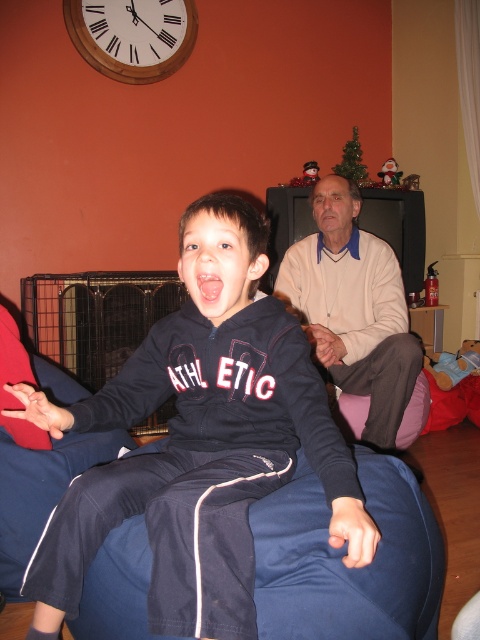
Question: Is dark blue athletic tracksuit at center smaller than light beige sweater at center?

Choices:
 (A) yes
 (B) no

Answer: (A)

Question: Is light beige sweater at center positioned at the back of wooden clock at upper left?

Choices:
 (A) no
 (B) yes

Answer: (A)

Question: Which point is farther to the camera?

Choices:
 (A) dark blue athletic tracksuit at center
 (B) wooden clock at upper left
 (C) light beige sweater at center

Answer: (B)

Question: Is dark blue athletic tracksuit at center to the left of wooden clock at upper left from the viewer's perspective?

Choices:
 (A) yes
 (B) no

Answer: (B)

Question: Which of the following is the closest to the observer?

Choices:
 (A) (173, 22)
 (B) (398, 369)

Answer: (B)

Question: Which point is farther to the camera?

Choices:
 (A) (115, 29)
 (B) (382, 269)
 (C) (228, 497)

Answer: (A)